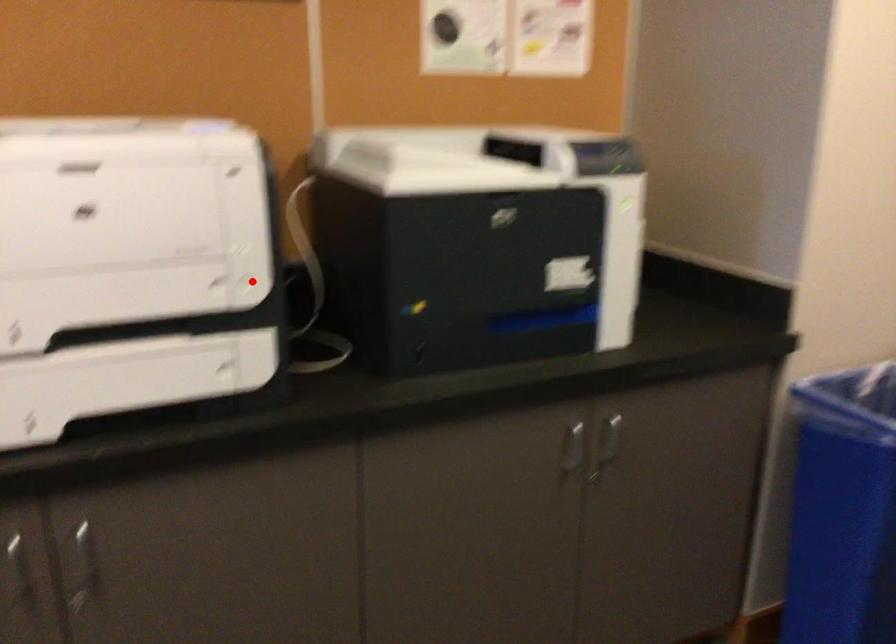
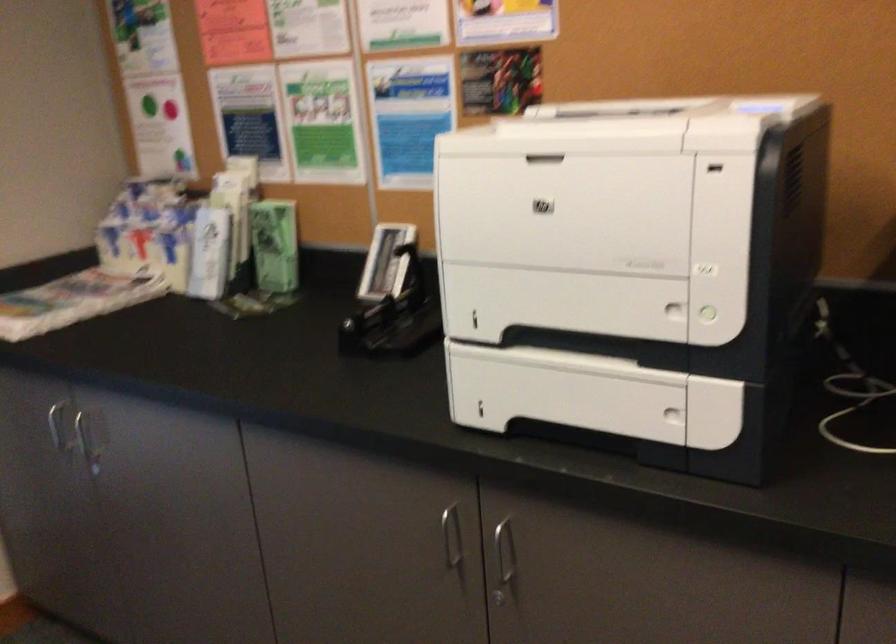
In the second image, find the point that corresponds to the highlighted location in the first image.

(709, 314)